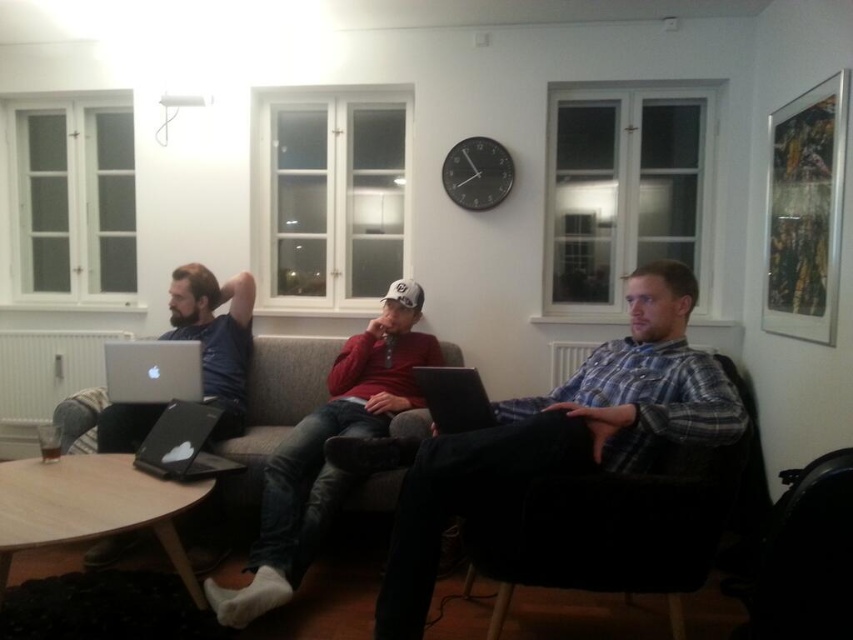
Question: Is matte black laptop at left bigger than black matte laptop at center?

Choices:
 (A) no
 (B) yes

Answer: (B)

Question: Does silver matte laptop at center appear over black matte laptop at center?

Choices:
 (A) yes
 (B) no

Answer: (B)

Question: Which point is farther from the camera taking this photo?

Choices:
 (A) (189, 285)
 (B) (459, 368)
 (C) (109, 362)
 (D) (228, 465)

Answer: (A)

Question: Which of the following is the farthest from the observer?

Choices:
 (A) plaid fabric shirt at center
 (B) silver matte laptop at center
 (C) silver metallic laptop at left

Answer: (C)

Question: Which is nearer to the silver matte laptop at center?

Choices:
 (A) matte black laptop at left
 (B) plaid fabric shirt at center

Answer: (A)

Question: Can you confirm if gray fabric couch at center is positioned below silver matte laptop at center?

Choices:
 (A) no
 (B) yes

Answer: (B)